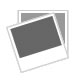
This screenshot has height=80, width=80. In order to click on 2 photographs in this screenshot , I will do `click(60, 55)`, `click(61, 18)`.